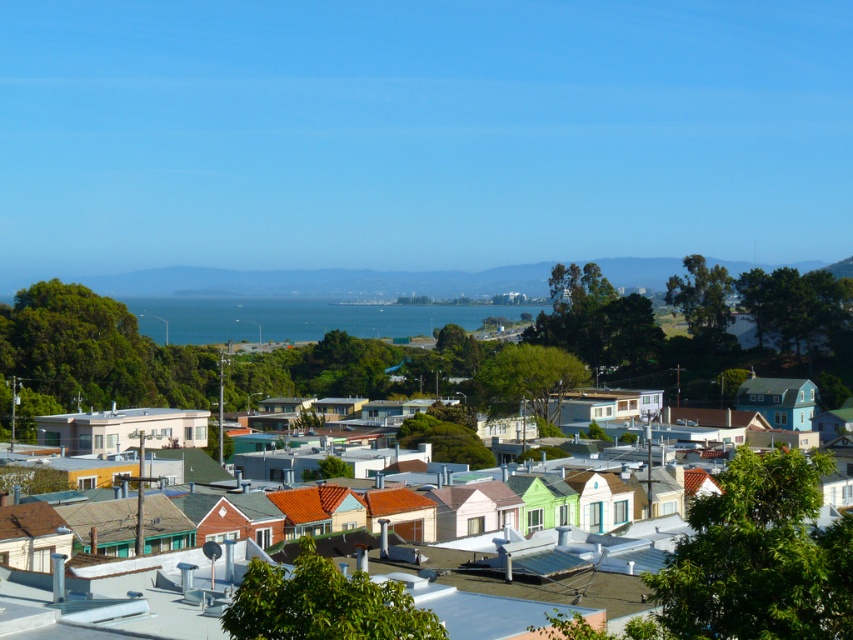
Question: Does multicolored rooftops at center come in front of blue water at center?

Choices:
 (A) yes
 (B) no

Answer: (A)

Question: Which point is farther to the camera?

Choices:
 (A) multicolored rooftops at center
 (B) blue water at center

Answer: (B)

Question: Can you confirm if multicolored rooftops at center is bigger than blue water at center?

Choices:
 (A) yes
 (B) no

Answer: (A)

Question: Does multicolored rooftops at center appear on the left side of blue water at center?

Choices:
 (A) yes
 (B) no

Answer: (B)

Question: Which point is closer to the camera?

Choices:
 (A) multicolored rooftops at center
 (B) blue water at center

Answer: (A)